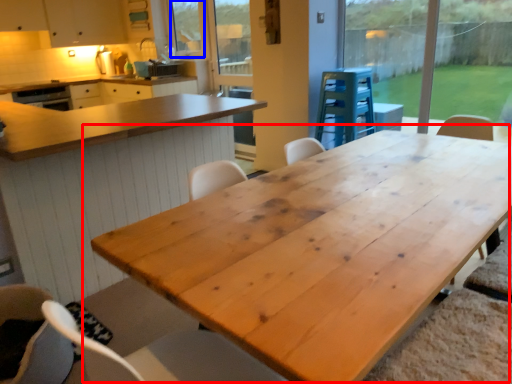
Question: Which object is closer to the camera taking this photo, table (highlighted by a red box) or window screen (highlighted by a blue box)?

Choices:
 (A) table
 (B) window screen

Answer: (A)